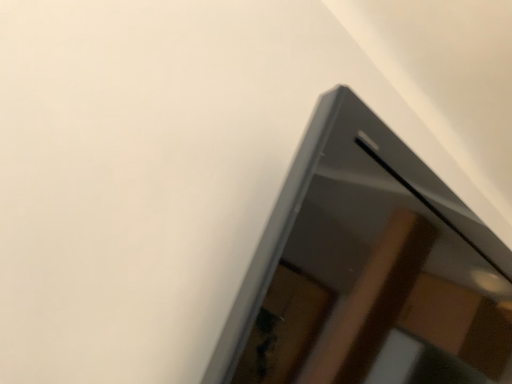
What do you see at coordinates (367, 271) in the screenshot?
I see `matte gray window at upper right` at bounding box center [367, 271].

Image resolution: width=512 pixels, height=384 pixels. I want to click on matte gray window at upper right, so (367, 271).

In order to face matte gray window at upper right, should I rotate leftwards or rightwards?

Turn right approximately 24.844 degrees to face it.

Identify the location of matte gray window at upper right. (367, 271).